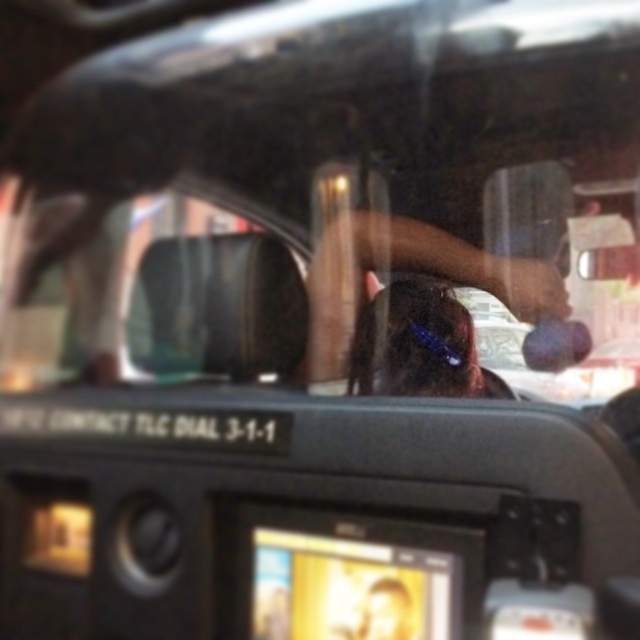
Question: Which of the following is the closest to the observer?

Choices:
 (A) (454, 276)
 (B) (464, 349)

Answer: (B)

Question: Considering the relative positions of brown hair at center and shiny blue hair at center in the image provided, where is brown hair at center located with respect to shiny blue hair at center?

Choices:
 (A) below
 (B) above

Answer: (B)

Question: Can you confirm if brown hair at center is positioned below shiny blue hair at center?

Choices:
 (A) yes
 (B) no

Answer: (B)

Question: Which of the following is the closest to the observer?

Choices:
 (A) shiny blue hair at center
 (B) brown hair at center

Answer: (B)

Question: Observing the image, what is the correct spatial positioning of brown hair at center in reference to shiny blue hair at center?

Choices:
 (A) below
 (B) above

Answer: (B)